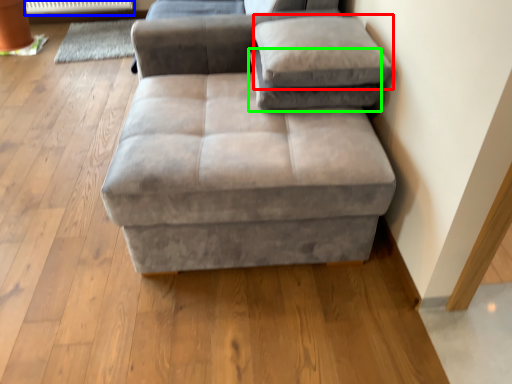
Question: Estimate the real-world distances between objects in this image. Which object is farther from pillow (highlighted by a red box), radiator (highlighted by a blue box) or pillow (highlighted by a green box)?

Choices:
 (A) radiator
 (B) pillow

Answer: (A)